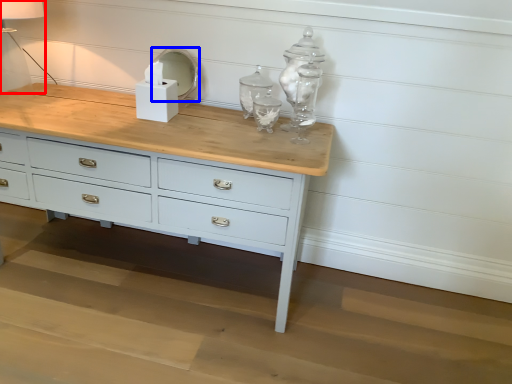
Question: Which object appears closest to the camera in this image, table lamp (highlighted by a red box) or mirror (highlighted by a blue box)?

Choices:
 (A) table lamp
 (B) mirror

Answer: (A)